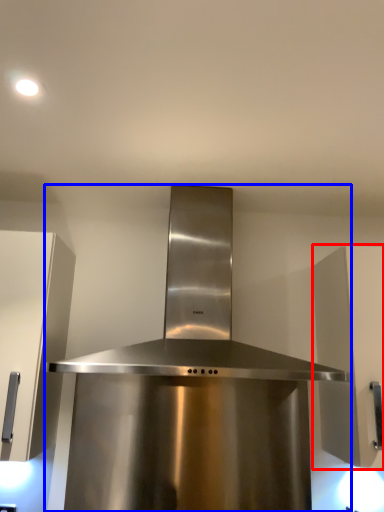
Question: Which object appears farthest to the camera in this image, cabinetry (highlighted by a red box) or home appliance (highlighted by a blue box)?

Choices:
 (A) cabinetry
 (B) home appliance

Answer: (A)